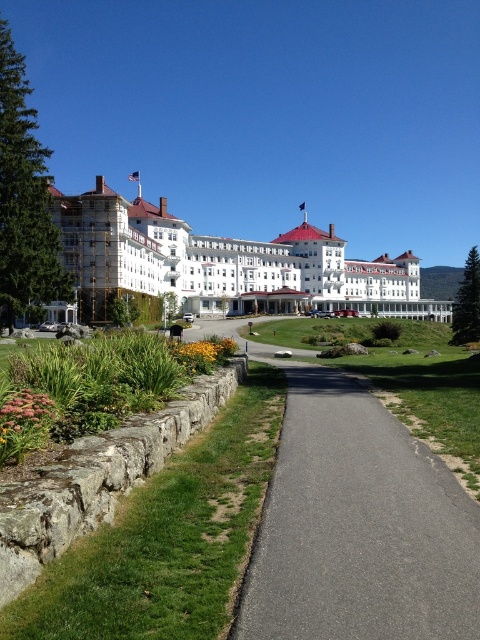
You are standing at the entrance of the grand building and want to take a photo. There are two points marked in the scene, point 1 at coordinates point (36, 429) and point 2 at coordinates point (228, 344). Which point is closer to you so that you can focus your camera lens properly?

Point (36, 429) is closer to the viewer than point (228, 344), so you should focus your camera lens on point (36, 429).

You are a tour guide leading a group to the historic hotel. You notice the asphalt path at center and the yellow matte flower at lower center. How far apart are these two landmarks from each other?

The asphalt path at center is 21.41 meters away from the yellow matte flower at lower center.